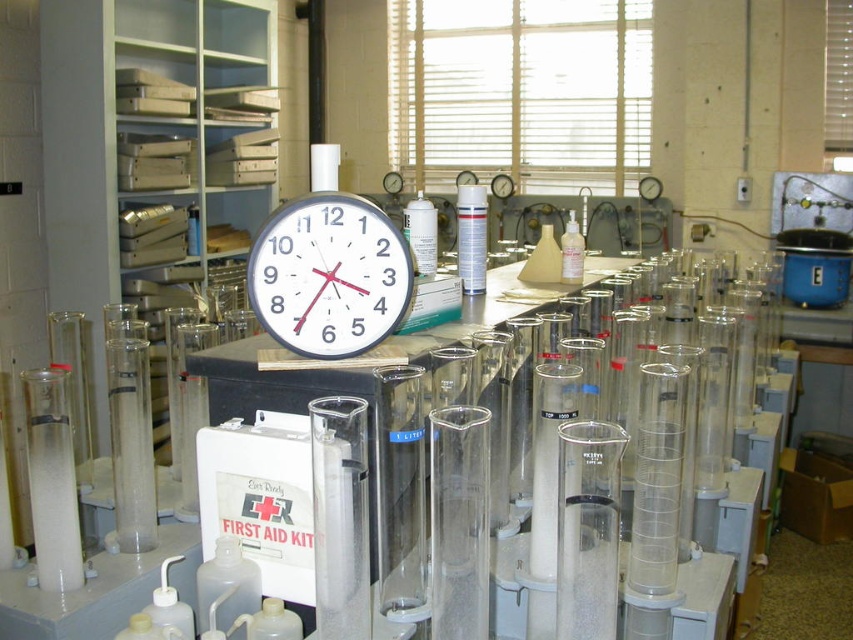
Between white plastic clock at center and translucent plastic bottle at center, which one appears on the left side from the viewer's perspective?

white plastic clock at center

Does white plastic clock at center have a smaller size compared to translucent plastic bottle at center?

No, white plastic clock at center is not smaller than translucent plastic bottle at center.

Is point (318, 200) positioned behind point (566, 228)?

No, it is not.

Identify the location of white plastic clock at center. The image size is (853, 640). (329, 275).